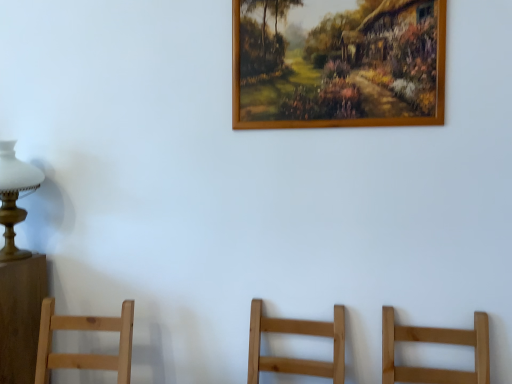
Question: From their relative heights in the image, would you say matte white glass at left is taller or shorter than wooden picture frame at upper center?

Choices:
 (A) short
 (B) tall

Answer: (A)

Question: In terms of width, does matte white glass at left look wider or thinner when compared to wooden picture frame at upper center?

Choices:
 (A) thin
 (B) wide

Answer: (B)

Question: From a real-world perspective, is matte white glass at left above or below wooden picture frame at upper center?

Choices:
 (A) above
 (B) below

Answer: (B)

Question: Considering the positions of wooden picture frame at upper center and matte white glass at left in the image, is wooden picture frame at upper center taller or shorter than matte white glass at left?

Choices:
 (A) tall
 (B) short

Answer: (A)

Question: In the image, is wooden picture frame at upper center positioned in front of or behind matte white glass at left?

Choices:
 (A) behind
 (B) front

Answer: (B)

Question: Would you say wooden picture frame at upper center is inside or outside matte white glass at left?

Choices:
 (A) inside
 (B) outside

Answer: (B)

Question: Considering the positions of point (248, 46) and point (1, 205), is point (248, 46) closer or farther from the camera than point (1, 205)?

Choices:
 (A) farther
 (B) closer

Answer: (B)